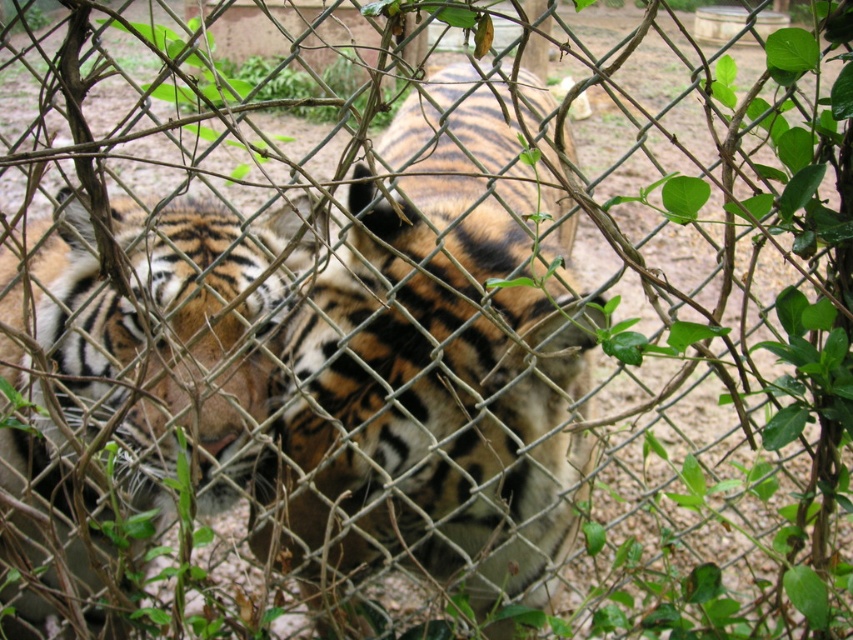
Does orange-brown fur tiger at center appear over orange-brown fur tiger at left?

Correct, orange-brown fur tiger at center is located above orange-brown fur tiger at left.

The height and width of the screenshot is (640, 853). I want to click on orange-brown fur tiger at center, so click(x=438, y=362).

Between point (498, 545) and point (0, 593), which one is positioned in front?

Point (498, 545) is more forward.

Image resolution: width=853 pixels, height=640 pixels. I want to click on orange-brown fur tiger at center, so click(438, 362).